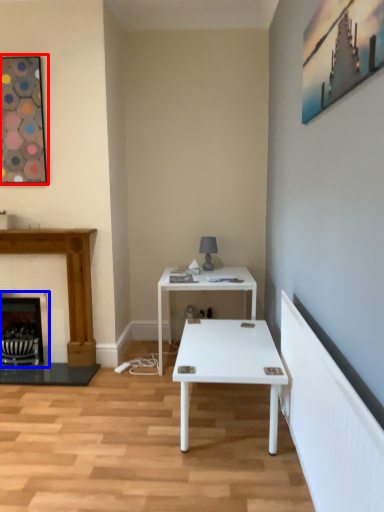
Question: Which object appears farthest to the camera in this image, picture frame (highlighted by a red box) or fireplace (highlighted by a blue box)?

Choices:
 (A) picture frame
 (B) fireplace

Answer: (B)